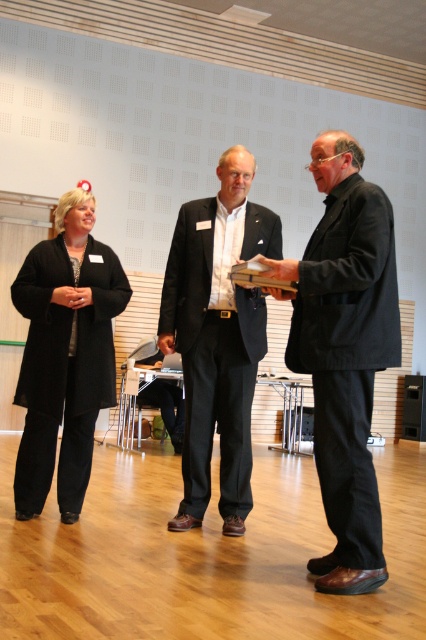
You are an event planner organizing a formal ceremony. You need to seat the two individuals in dark gray suit at center and black matte suit at center such that the wider one sits on the left side of the stage. Which individual should be seated on the left?

The black matte suit at center is wider than the dark gray suit at center. Therefore, the black matte suit at center should be seated on the left side of the stage.

In the scene shown: In the formal indoor setting, there are two individuals wearing the dark gray suit at center and the black matte suit at center. Which one is located lower in the image?

The dark gray suit at center is positioned under the black matte suit at center, so it is located lower in the image.

You are an event planner arranging seating for a ceremony. You need to place a podium between the black matte suit at center and the black fabric coat at left. Based on their positions, where should the podium be placed relative to these two individuals?

The podium should be placed between the black matte suit at center and the black fabric coat at left, as the black matte suit at center is positioned over the black fabric coat at left, indicating they are standing close to each other in the center area.